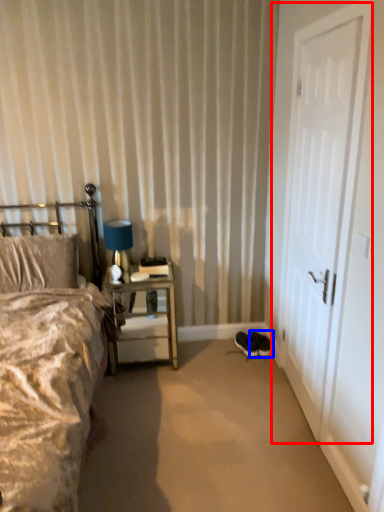
Question: Which of the following is the closest to the observer, door (highlighted by a red box) or footwear (highlighted by a blue box)?

Choices:
 (A) door
 (B) footwear

Answer: (A)